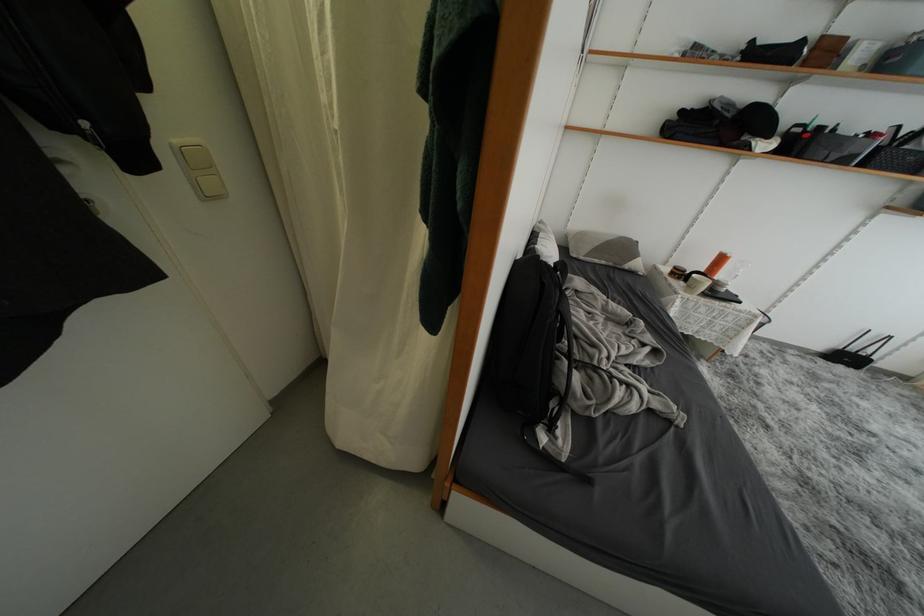
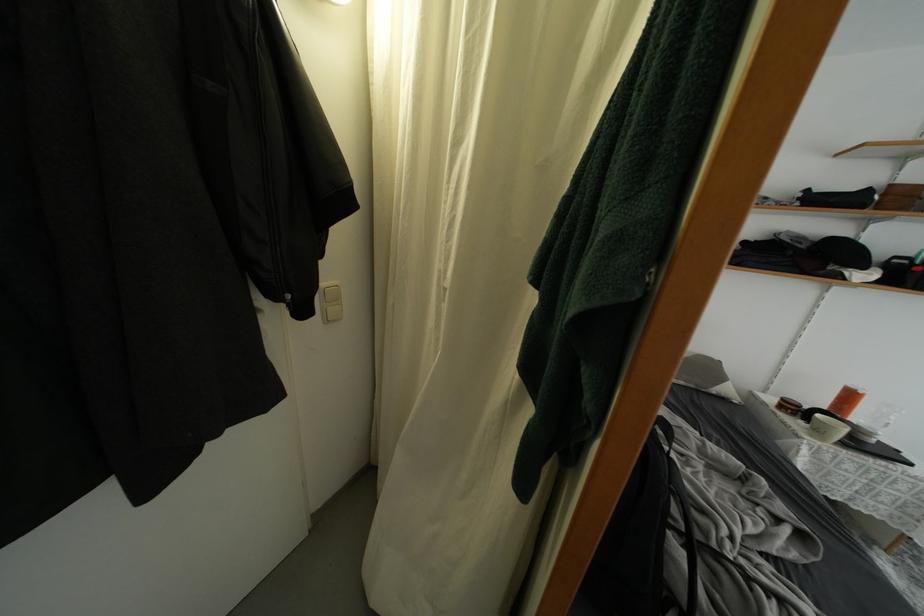
In the second image, find the point that corresponds to point (697, 292) in the first image.

(823, 437)